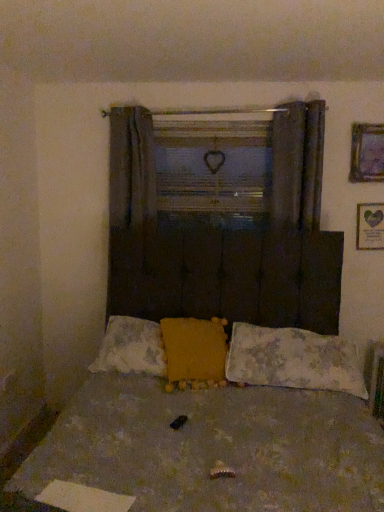
Question: Is white plastic radiator at lower right outside of green paper picture frame at upper right, which is counted as the second picture frame, starting from the top?

Choices:
 (A) no
 (B) yes

Answer: (B)

Question: Is white plastic radiator at lower right thinner than green paper picture frame at upper right, which is counted as the second picture frame, starting from the top?

Choices:
 (A) no
 (B) yes

Answer: (A)

Question: Can you confirm if white plastic radiator at lower right is bigger than green paper picture frame at upper right, which is counted as the second picture frame, starting from the top?

Choices:
 (A) no
 (B) yes

Answer: (B)

Question: Can you confirm if white plastic radiator at lower right is taller than green paper picture frame at upper right, which is counted as the second picture frame, starting from the top?

Choices:
 (A) no
 (B) yes

Answer: (B)

Question: From a real-world perspective, is white plastic radiator at lower right beneath green paper picture frame at upper right, which is counted as the second picture frame, starting from the top?

Choices:
 (A) yes
 (B) no

Answer: (A)

Question: Is white plastic radiator at lower right not close to green paper picture frame at upper right, the 1th picture frame ordered from the bottom?

Choices:
 (A) yes
 (B) no

Answer: (B)

Question: Is wooden frame at center facing towards fluffy white pillow at center, which ranks as the 3th pillow in left-to-right order?

Choices:
 (A) no
 (B) yes

Answer: (A)

Question: Is wooden frame at center completely or partially outside of fluffy white pillow at center, which is the first pillow in right-to-left order?

Choices:
 (A) no
 (B) yes

Answer: (B)

Question: Are wooden frame at center and fluffy white pillow at center, which is the first pillow in right-to-left order, far apart?

Choices:
 (A) no
 (B) yes

Answer: (B)

Question: Considering the relative positions of wooden frame at center and fluffy white pillow at center, which is the first pillow in right-to-left order, in the image provided, is wooden frame at center to the right of fluffy white pillow at center, which is the first pillow in right-to-left order, from the viewer's perspective?

Choices:
 (A) yes
 (B) no

Answer: (B)

Question: Does wooden frame at center come behind fluffy white pillow at center, which is the first pillow in right-to-left order?

Choices:
 (A) yes
 (B) no

Answer: (A)

Question: Considering the relative sizes of wooden frame at center and fluffy white pillow at center, which is the first pillow in right-to-left order, in the image provided, is wooden frame at center wider than fluffy white pillow at center, which is the first pillow in right-to-left order,?

Choices:
 (A) yes
 (B) no

Answer: (B)

Question: Does fluffy white pillow at center, which ranks as the 3th pillow in left-to-right order, appear on the right side of dark gray fabric curtain at upper center?

Choices:
 (A) no
 (B) yes

Answer: (A)